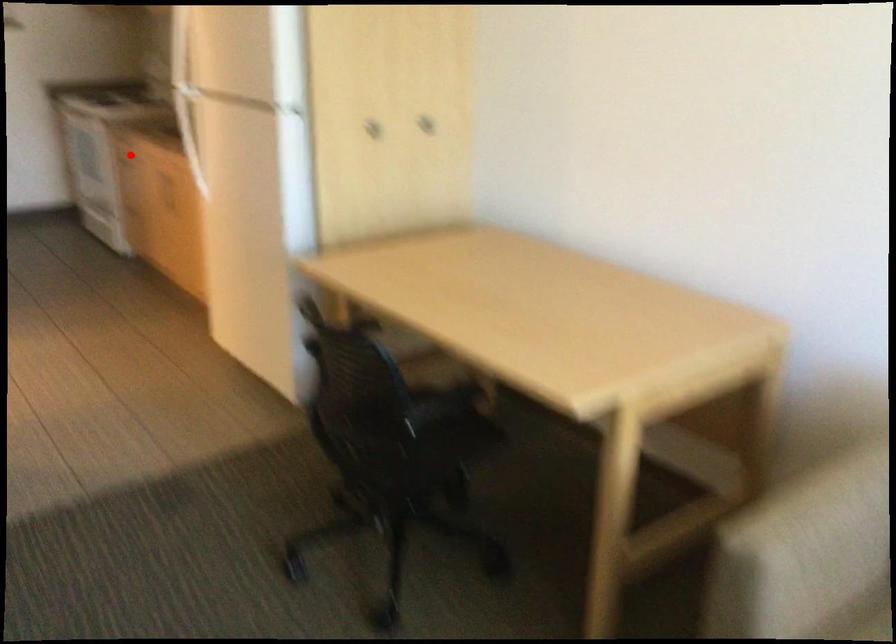
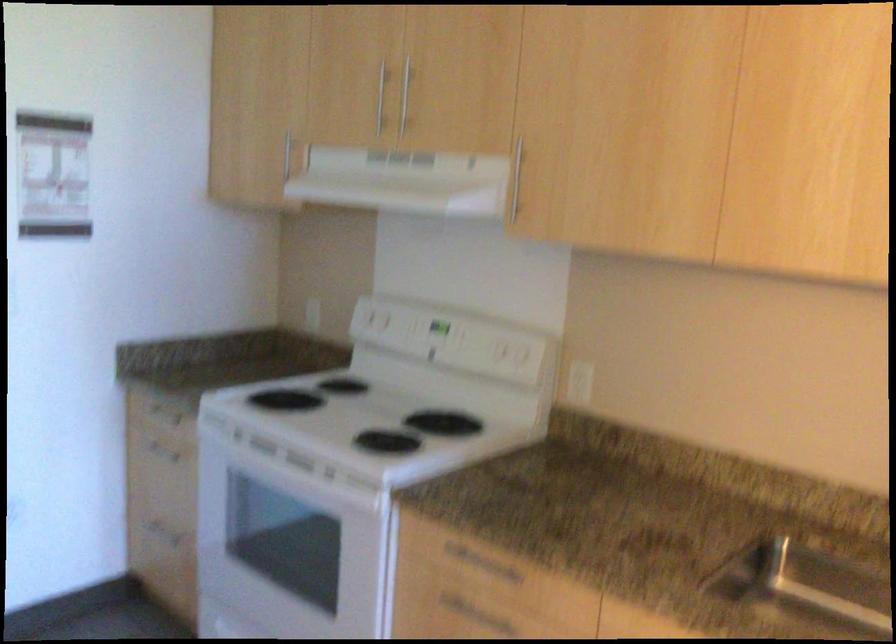
Question: I am providing you with two images of the same scene from different viewpoints. Given a red point in image1, look at the same physical point in image2. Is it:

Choices:
 (A) Closer to the viewpoint
 (B) Farther from the viewpoint

Answer: (A)